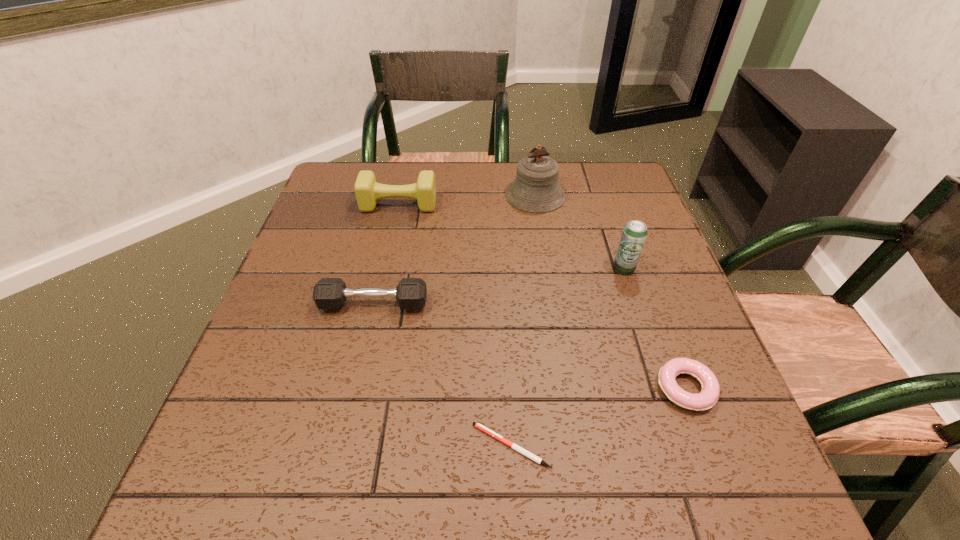
Image resolution: width=960 pixels, height=540 pixels. I want to click on bell, so click(x=536, y=189).

Locate an element on the screen. the second tallest object is located at coordinates (634, 234).

Identify the location of beer can. The height and width of the screenshot is (540, 960). (634, 234).

The height and width of the screenshot is (540, 960). Identify the location of the fourth shortest object. (367, 190).

Locate an element on the screen. The image size is (960, 540). the taller dumbbell is located at coordinates (367, 190).

Locate an element on the screen. This screenshot has height=540, width=960. the fourth farthest object is located at coordinates (329, 293).

I want to click on the shorter dumbbell, so click(x=329, y=293).

Find the location of a particular element. The width and height of the screenshot is (960, 540). doughnut is located at coordinates (707, 398).

The width and height of the screenshot is (960, 540). I want to click on the second nearest object, so click(x=707, y=398).

The height and width of the screenshot is (540, 960). Identify the location of pen. (521, 450).